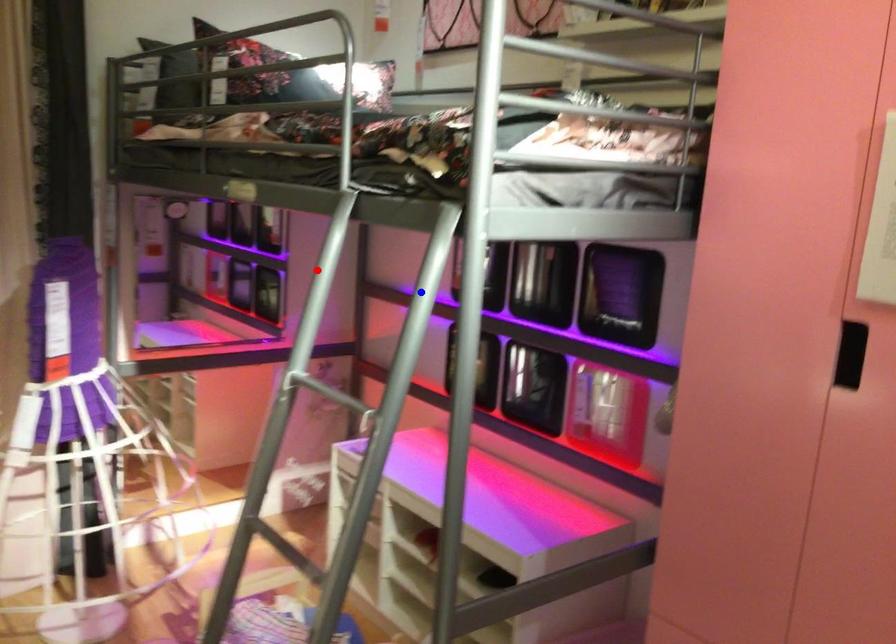
Question: Which of the two points in the image is closer to the camera?

Choices:
 (A) Blue point is closer.
 (B) Red point is closer.

Answer: (A)